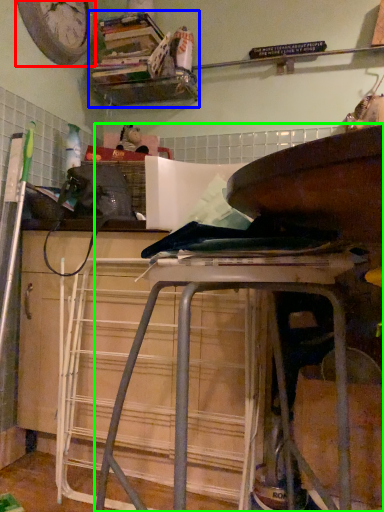
Question: Based on their relative distances, which object is farther from clock (highlighted by a red box)? Choose from shelf (highlighted by a blue box) and furniture (highlighted by a green box).

Choices:
 (A) shelf
 (B) furniture

Answer: (B)